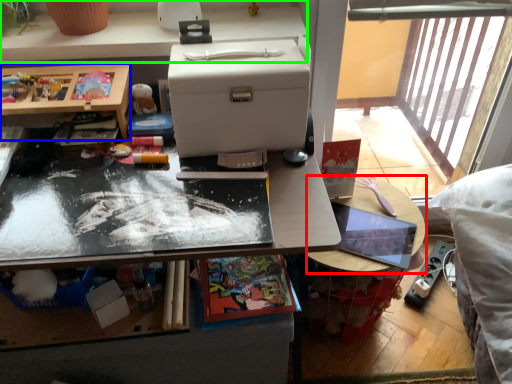
Question: Which object is the closest to the table (highlighted by a red box)? Choose among these: desk (highlighted by a blue box) or desk (highlighted by a green box).

Choices:
 (A) desk
 (B) desk

Answer: (B)